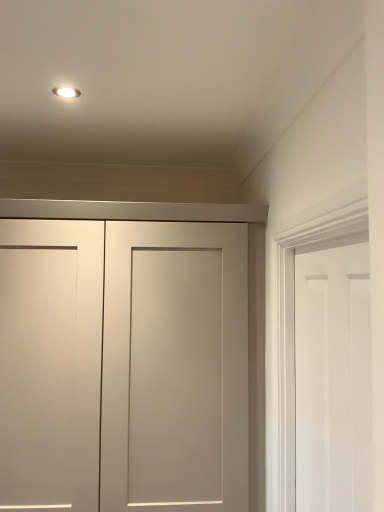
Question: Does white matte door at right, marked as the 2th door in a back-to-front arrangement, have a greater width compared to matte white cabinet at center, marked as the 2th door in a front-to-back arrangement?

Choices:
 (A) yes
 (B) no

Answer: (B)

Question: Is matte white cabinet at center, arranged as the 2th door when viewed from the right, inside white matte door at right, marked as the 2th door in a back-to-front arrangement?

Choices:
 (A) yes
 (B) no

Answer: (B)

Question: Does white matte door at right, marked as the 2th door in a back-to-front arrangement, appear on the left side of matte white cabinet at center, placed as the 1th door when sorted from left to right?

Choices:
 (A) yes
 (B) no

Answer: (B)

Question: Can we say white matte door at right, which appears as the 2th door when viewed from the left, lies outside matte white cabinet at center, the 1th door when ordered from back to front?

Choices:
 (A) yes
 (B) no

Answer: (A)

Question: Considering the relative sizes of white matte door at right, the 1th door when ordered from front to back, and matte white cabinet at center, the 1th door when ordered from back to front, in the image provided, is white matte door at right, the 1th door when ordered from front to back, bigger than matte white cabinet at center, the 1th door when ordered from back to front,?

Choices:
 (A) yes
 (B) no

Answer: (B)

Question: From the image's perspective, is white matte door at right, marked as the 2th door in a back-to-front arrangement, below matte white cabinet at center, the 1th door when ordered from back to front?

Choices:
 (A) no
 (B) yes

Answer: (A)

Question: Does matte white cabinet at center, placed as the 1th door when sorted from left to right, have a smaller size compared to white matte door at right, marked as the 2th door in a back-to-front arrangement?

Choices:
 (A) yes
 (B) no

Answer: (B)

Question: From the image's perspective, does matte white cabinet at center, placed as the 1th door when sorted from left to right, appear lower than white matte door at right, acting as the first door starting from the right?

Choices:
 (A) no
 (B) yes

Answer: (B)

Question: Does matte white cabinet at center, placed as the 1th door when sorted from left to right, have a greater height compared to white matte door at right, marked as the 2th door in a back-to-front arrangement?

Choices:
 (A) no
 (B) yes

Answer: (B)

Question: Is matte white cabinet at center, arranged as the 2th door when viewed from the right, positioned with its back to white matte door at right, the 1th door when ordered from front to back?

Choices:
 (A) no
 (B) yes

Answer: (A)

Question: From a real-world perspective, is matte white cabinet at center, the 1th door when ordered from back to front, on white matte door at right, which appears as the 2th door when viewed from the left?

Choices:
 (A) yes
 (B) no

Answer: (B)

Question: Would you say white matte door at right, acting as the first door starting from the right, is part of matte white cabinet at center, placed as the 1th door when sorted from left to right,'s contents?

Choices:
 (A) no
 (B) yes

Answer: (A)

Question: From the image's perspective, is matte white cabinet at center, the 1th door when ordered from back to front, located above or below white matte door at right, marked as the 2th door in a back-to-front arrangement?

Choices:
 (A) above
 (B) below

Answer: (B)